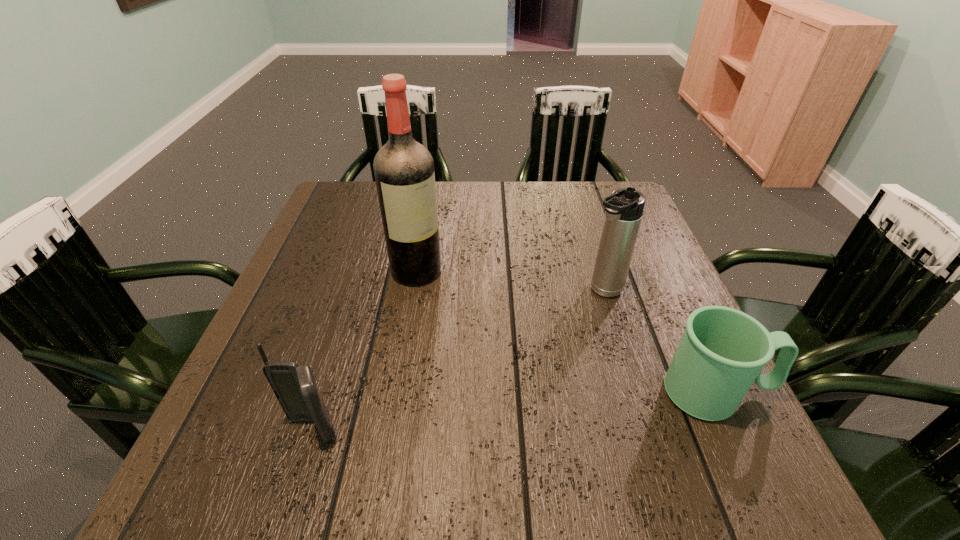
Where is `free location located 0.230m on the front-facing side of the liquor`? This screenshot has height=540, width=960. free location located 0.230m on the front-facing side of the liquor is located at coordinates (488, 348).

Locate an element on the screen. The height and width of the screenshot is (540, 960). vacant area situated 0.130m on the handle side of the thermos bottle is located at coordinates (555, 334).

You are a GUI agent. You are given a task and a screenshot of the screen. Output one action in this format:
    pyautogui.click(x=<x>, y=<y>)
    Task: Click on the free spot located 0.070m on the handle side of the thermos bottle
    Image resolution: width=960 pixels, height=540 pixels.
    Given the screenshot: What is the action you would take?
    pyautogui.click(x=572, y=319)

The image size is (960, 540). In order to click on free space located on the handle side of the thermos bottle in this screenshot , I will do `click(542, 345)`.

In order to click on cellular telephone that is positioned at the near edge in this screenshot , I will do `click(294, 386)`.

Identify the location of mug located at the near edge. The image size is (960, 540). (722, 352).

Identify the location of object that is at the left edge. Image resolution: width=960 pixels, height=540 pixels. (294, 386).

The width and height of the screenshot is (960, 540). Find the location of `mug at the right edge`. mug at the right edge is located at coordinates (722, 352).

Identify the location of thermos bottle located at the right edge. The height and width of the screenshot is (540, 960). (624, 208).

Where is `object located in the near left corner section of the desktop`? This screenshot has width=960, height=540. object located in the near left corner section of the desktop is located at coordinates (294, 386).